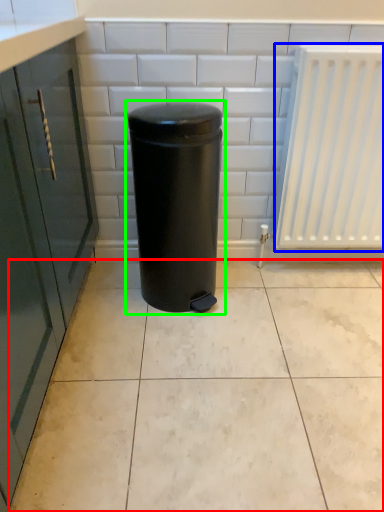
Question: Estimate the real-world distances between objects in this image. Which object is farther from ceramic tile (highlighted by a red box), radiator (highlighted by a blue box) or waste container (highlighted by a green box)?

Choices:
 (A) radiator
 (B) waste container

Answer: (A)